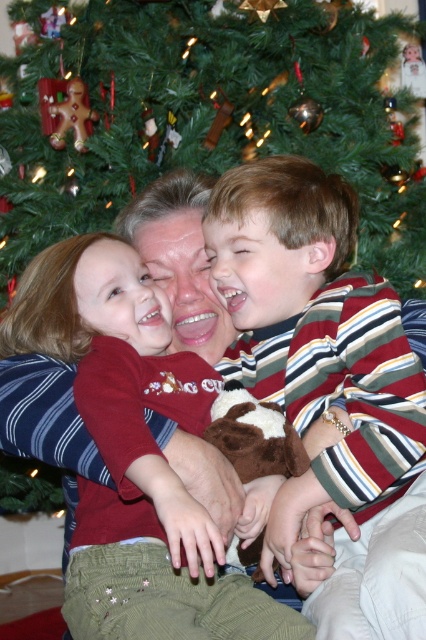
Does striped cotton shirt at center appear under matte gingerbread man at upper left?

A: Indeed, striped cotton shirt at center is positioned under matte gingerbread man at upper left.

Who is more forward, (403, 556) or (52, 115)?

Point (403, 556)

Does point (422, 392) lie in front of point (54, 132)?

Yes, it is.

Locate an element on the screen. This screenshot has width=426, height=640. striped cotton shirt at center is located at coordinates (327, 385).

Is matte red shirt at center smaller than matte gingerbread man at upper left?

Incorrect, matte red shirt at center is not smaller in size than matte gingerbread man at upper left.

Is matte red shirt at center below matte gingerbread man at upper left?

Correct, matte red shirt at center is located below matte gingerbread man at upper left.

Does point (112, 237) come behind point (86, 112)?

That is False.

Image resolution: width=426 pixels, height=640 pixels. I want to click on matte red shirt at center, so click(x=146, y=474).

Who is taller, striped cotton shirt at center or matte red shirt at center?

striped cotton shirt at center

What do you see at coordinates (327, 385) in the screenshot? This screenshot has width=426, height=640. I see `striped cotton shirt at center` at bounding box center [327, 385].

Who is more forward, (396, 481) or (155, 301)?

Point (396, 481) is in front.

This screenshot has width=426, height=640. I want to click on striped cotton shirt at center, so click(327, 385).